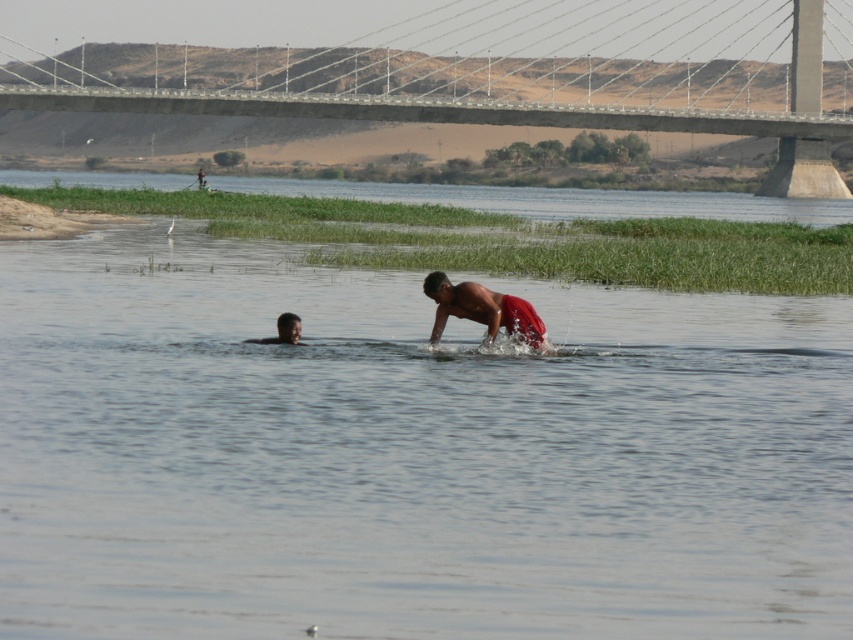
Question: Is concrete bridge at upper center wider than red fabric person at center?

Choices:
 (A) yes
 (B) no

Answer: (A)

Question: Which point is farther to the camera?

Choices:
 (A) (643, 195)
 (B) (508, 328)
 (C) (277, 332)

Answer: (A)

Question: Can you confirm if red fabric person at center is smaller than dark skin head at lower left?

Choices:
 (A) no
 (B) yes

Answer: (A)

Question: From the image, what is the correct spatial relationship of concrete bridge at upper center in relation to dark skin head at lower left?

Choices:
 (A) below
 (B) above

Answer: (B)

Question: Considering the real-world distances, which object is farthest from the clear water at center?

Choices:
 (A) red fabric person at center
 (B) clear water at river center

Answer: (B)

Question: Estimate the real-world distances between objects in this image. Which object is farther from the red fabric person at center?

Choices:
 (A) clear water at center
 (B) concrete bridge at upper center

Answer: (B)